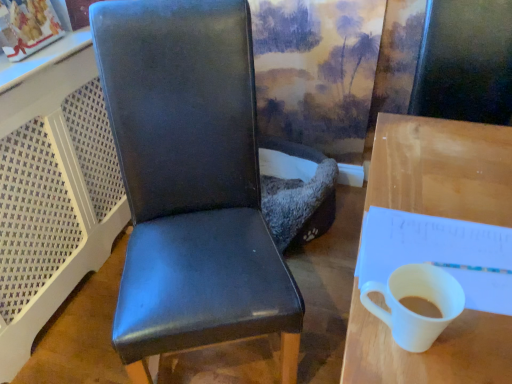
Question: Can you confirm if matte black chair at center is positioned to the right of white paper notepad at right?

Choices:
 (A) no
 (B) yes

Answer: (A)

Question: Does matte black chair at center have a greater height compared to white paper notepad at right?

Choices:
 (A) no
 (B) yes

Answer: (B)

Question: Does matte black chair at center have a lesser height compared to white paper notepad at right?

Choices:
 (A) no
 (B) yes

Answer: (A)

Question: From a real-world perspective, is matte black chair at center on top of white paper notepad at right?

Choices:
 (A) yes
 (B) no

Answer: (B)

Question: Does matte black chair at center have a larger size compared to white paper notepad at right?

Choices:
 (A) no
 (B) yes

Answer: (B)

Question: Is matte black chair at center wider or thinner than wooden desk at right?

Choices:
 (A) wide
 (B) thin

Answer: (B)

Question: In terms of size, does matte black chair at center appear bigger or smaller than wooden desk at right?

Choices:
 (A) big
 (B) small

Answer: (B)

Question: Would you say matte black chair at center is to the left or to the right of wooden desk at right in the picture?

Choices:
 (A) right
 (B) left

Answer: (B)

Question: In terms of height, does matte black chair at center look taller or shorter compared to wooden desk at right?

Choices:
 (A) tall
 (B) short

Answer: (A)

Question: Is white paper notepad at right in front of or behind white glossy mug at right in the image?

Choices:
 (A) front
 (B) behind

Answer: (B)

Question: From a real-world perspective, is white paper notepad at right above or below white glossy mug at right?

Choices:
 (A) below
 (B) above

Answer: (A)

Question: Which is correct: white paper notepad at right is inside white glossy mug at right, or outside of it?

Choices:
 (A) inside
 (B) outside

Answer: (B)

Question: Visually, is white paper notepad at right positioned to the left or to the right of white glossy mug at right?

Choices:
 (A) left
 (B) right

Answer: (B)

Question: In terms of height, does wooden desk at right look taller or shorter compared to white glossy mug at right?

Choices:
 (A) tall
 (B) short

Answer: (A)

Question: From the image's perspective, relative to white glossy mug at right, is wooden desk at right above or below?

Choices:
 (A) below
 (B) above

Answer: (A)